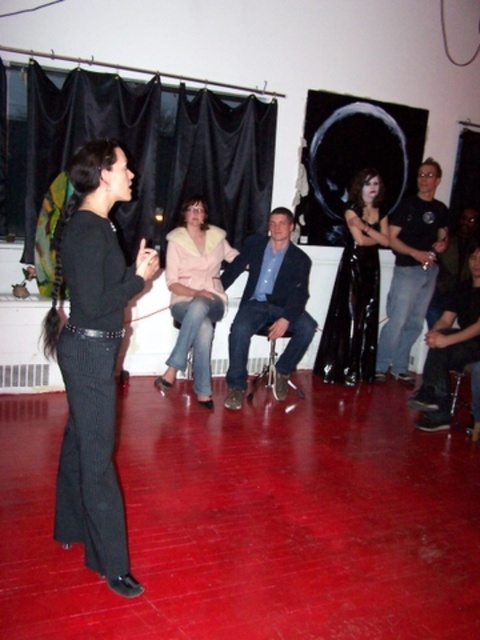
Is the position of black pinstripe pants at left less distant than that of blue denim jeans at center?

That is True.

From the picture: Is the position of black pinstripe pants at left more distant than that of blue denim jeans at center?

No, black pinstripe pants at left is in front of blue denim jeans at center.

The height and width of the screenshot is (640, 480). Describe the element at coordinates (94, 356) in the screenshot. I see `black pinstripe pants at left` at that location.

This screenshot has height=640, width=480. In order to click on black pinstripe pants at left in this screenshot , I will do `click(94, 356)`.

Does point (68, 364) come farther from viewer compared to point (231, 248)?

No, it is in front of (231, 248).

Where is `black pinstripe pants at left`? black pinstripe pants at left is located at coordinates (94, 356).

What are the coordinates of `black pinstripe pants at left` in the screenshot? It's located at (94, 356).

Is blue denim jeans at center to the left of pink fuzzy coat at center from the viewer's perspective?

In fact, blue denim jeans at center is to the right of pink fuzzy coat at center.

Is blue denim jeans at center positioned at the back of pink fuzzy coat at center?

Yes, blue denim jeans at center is behind pink fuzzy coat at center.

In order to click on blue denim jeans at center in this screenshot , I will do `click(268, 304)`.